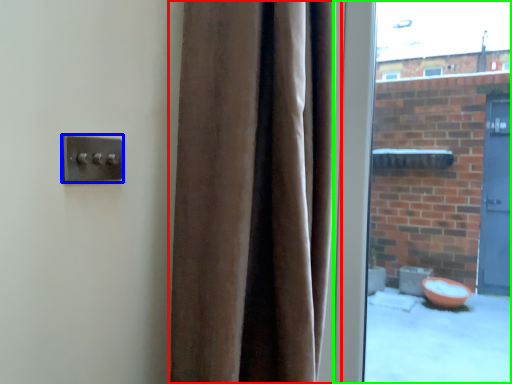
Question: Based on their relative distances, which object is farther from curtain (highlighted by a red box)? Choose from door handle (highlighted by a blue box) and window (highlighted by a green box).

Choices:
 (A) door handle
 (B) window

Answer: (B)